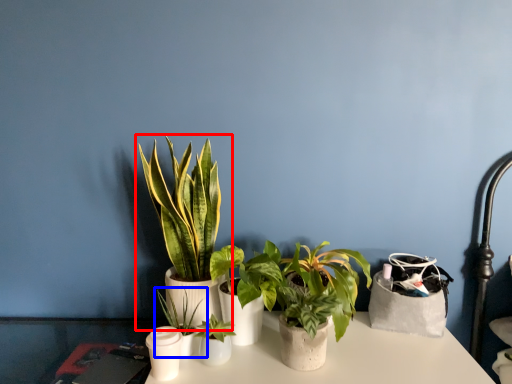
Question: Which object is further to the camera taking this photo, houseplant (highlighted by a red box) or houseplant (highlighted by a blue box)?

Choices:
 (A) houseplant
 (B) houseplant

Answer: (B)